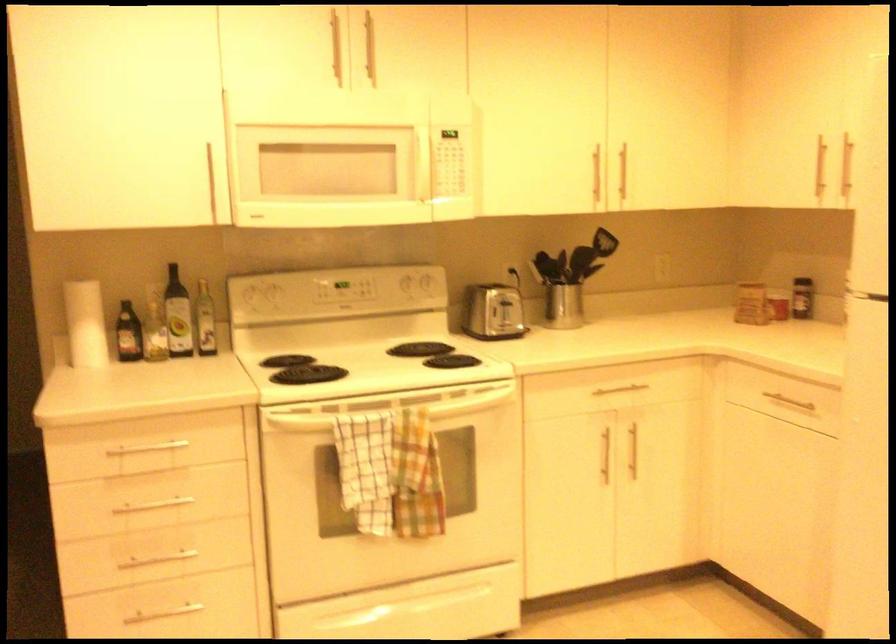
What do you see at coordinates (364, 363) in the screenshot? I see `the white stove knob` at bounding box center [364, 363].